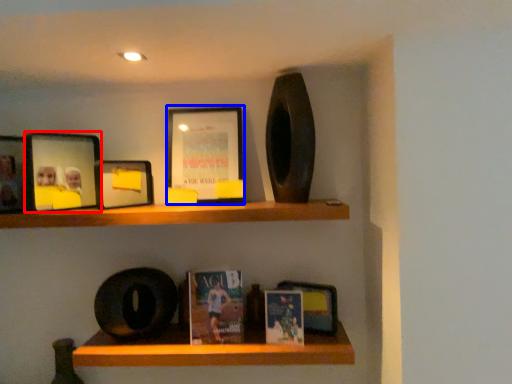
Question: Which object appears closest to the camera in this image, picture frame (highlighted by a red box) or picture frame (highlighted by a blue box)?

Choices:
 (A) picture frame
 (B) picture frame

Answer: (A)